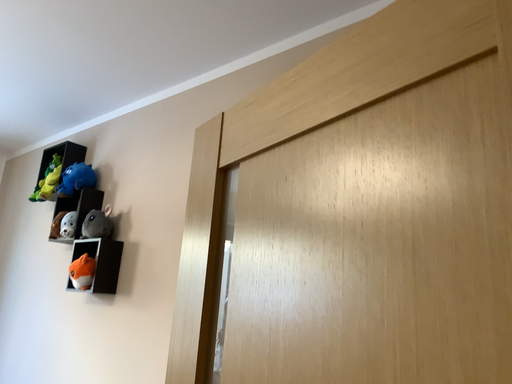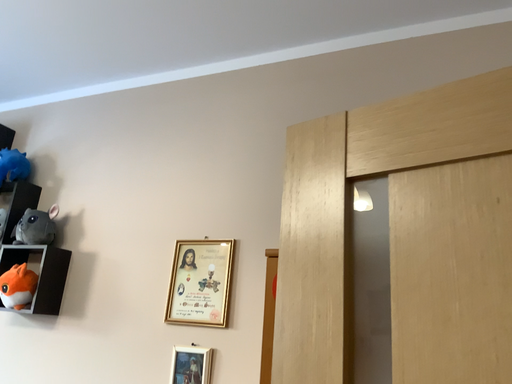
Question: Which way did the camera rotate in the video?

Choices:
 (A) rotated right
 (B) rotated left

Answer: (A)